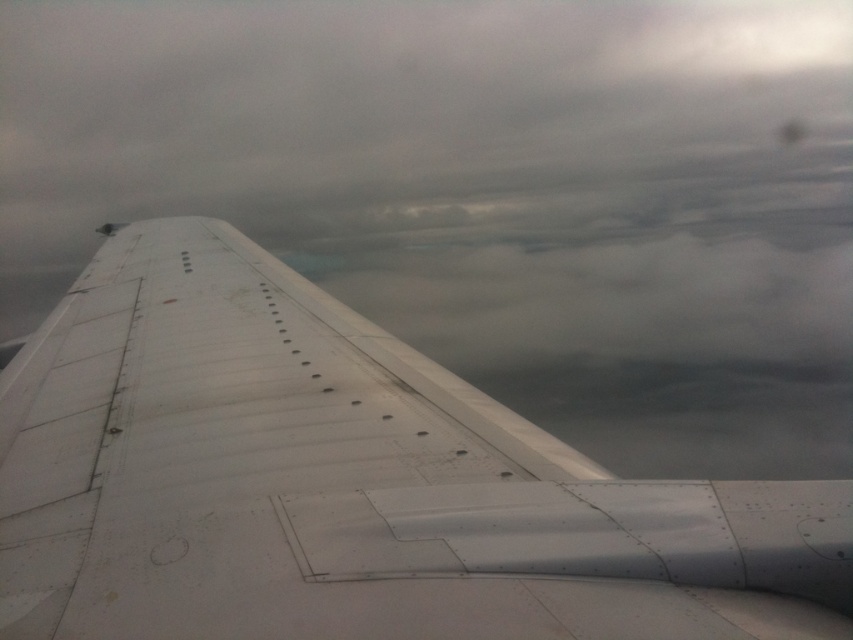
You are a passenger sitting in an aircraft seat and looking out the window. You notice two wings in your view. Which wing, the white matte wing at center or the metallic white wing at center, is closer to you?

The white matte wing at center is closer to you because the metallic white wing at center is behind it.

You are a passenger sitting in an airplane seat and looking out the window. You notice a point at coordinates [485,193]. What object is located at that point?

The white matte wing at center is located at point [485,193].